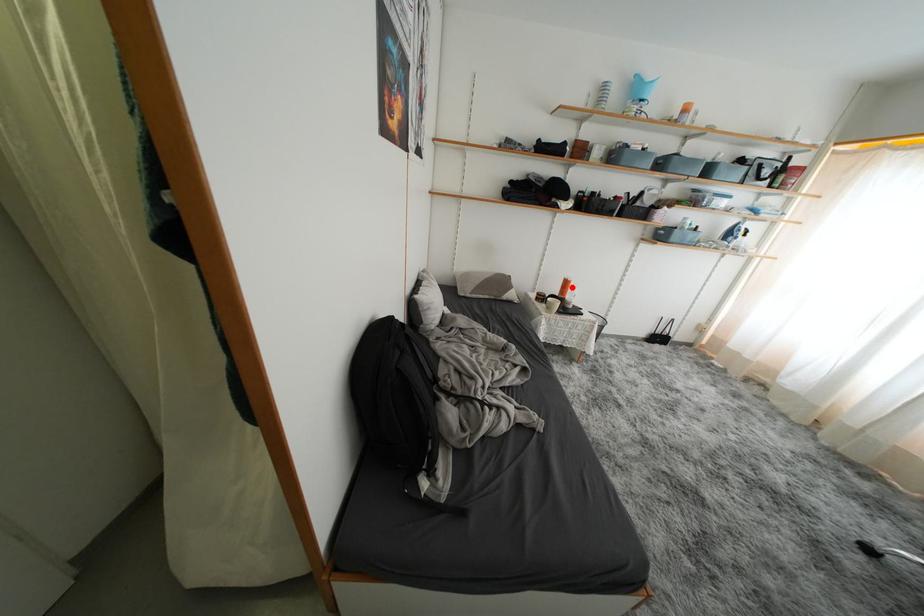
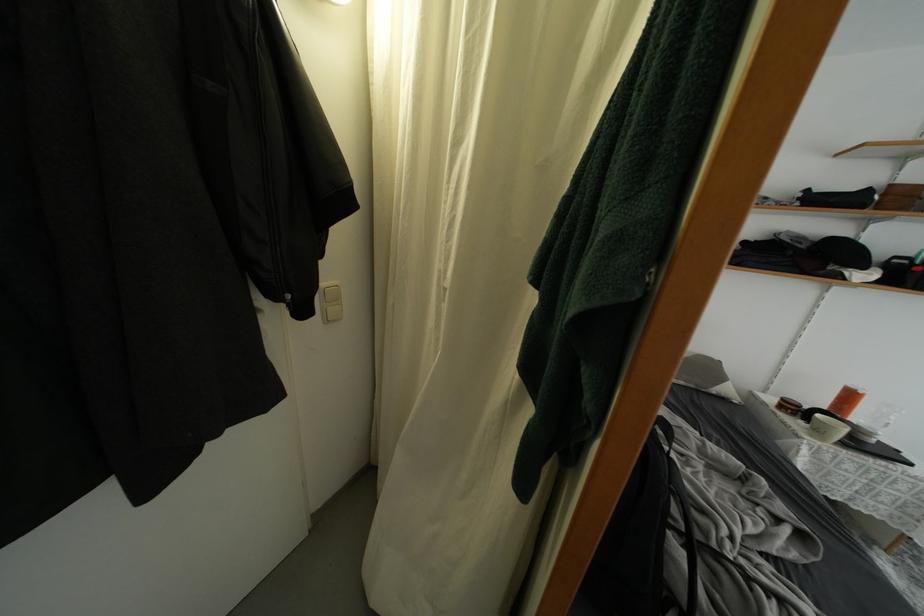
In the second image, find the point that corresponds to the highlighted location in the first image.

(856, 400)